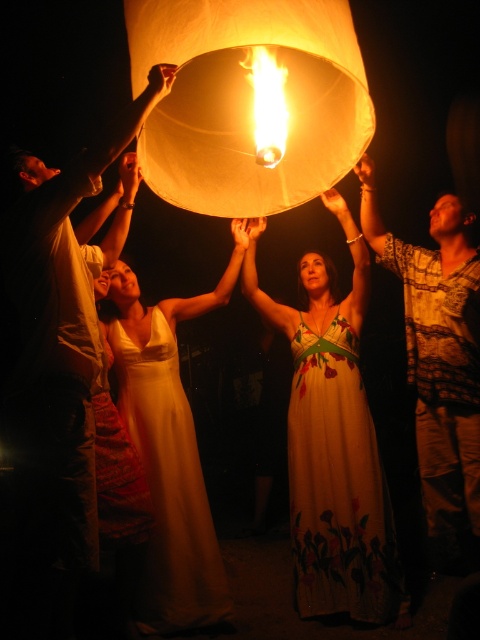
Question: Is matte white dress at upper center to the left of white floral dress at center from the viewer's perspective?

Choices:
 (A) no
 (B) yes

Answer: (B)

Question: Is white floral dress at center positioned behind bright yellow flame at center?

Choices:
 (A) no
 (B) yes

Answer: (B)

Question: Does satin gold dress at center have a larger size compared to bright yellow flame at center?

Choices:
 (A) no
 (B) yes

Answer: (B)

Question: Which point is closer to the camera taking this photo?

Choices:
 (A) (447, 323)
 (B) (279, 68)

Answer: (B)

Question: Which point is farther to the camera?

Choices:
 (A) satin gold dress at center
 (B) white floral dress at center
 (C) bright yellow flame at center

Answer: (A)

Question: Which point appears closest to the camera in this image?

Choices:
 (A) (184, 508)
 (B) (309, 168)

Answer: (B)